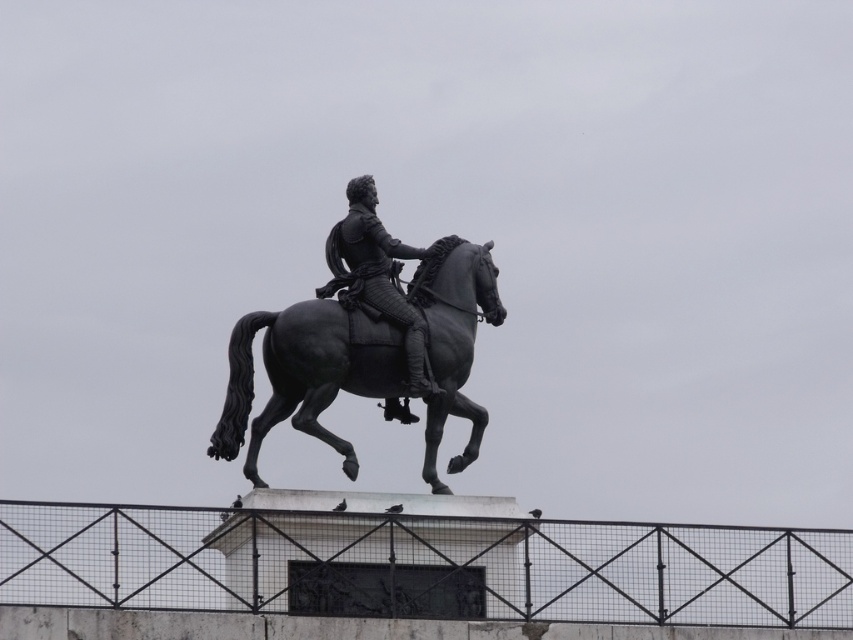
Does black metal fence at center appear on the right side of polished black horse at center?

Correct, you'll find black metal fence at center to the right of polished black horse at center.

Is black metal fence at center above polished black horse at center?

Actually, black metal fence at center is below polished black horse at center.

Which is in front, point (16, 532) or point (383, 394)?

Positioned in front is point (16, 532).

Identify the location of black metal fence at center. tap(422, 564).

Between polished black horse at center and polished bronze statue at center, which one has less height?

polished bronze statue at center

Identify the location of polished black horse at center. (305, 374).

Locate an element on the screen. polished black horse at center is located at coordinates (305, 374).

Is point (489, 536) positioned in front of point (396, 288)?

Yes, it is in front of point (396, 288).

Does black metal fence at center lie in front of polished bronze statue at center?

Yes, it is in front of polished bronze statue at center.

Locate an element on the screen. black metal fence at center is located at coordinates (422, 564).

I want to click on black metal fence at center, so 422,564.